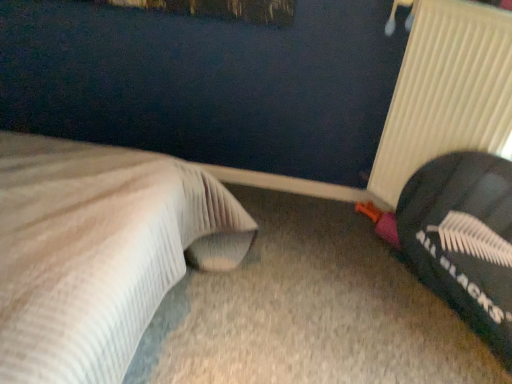
Question: Are white ribbed radiator at right and white textured bed at left making contact?

Choices:
 (A) no
 (B) yes

Answer: (A)

Question: Could white textured bed at left be considered to be inside white ribbed radiator at right?

Choices:
 (A) no
 (B) yes

Answer: (A)

Question: Is white ribbed radiator at right oriented towards white textured bed at left?

Choices:
 (A) no
 (B) yes

Answer: (B)

Question: Can you confirm if white ribbed radiator at right is shorter than white textured bed at left?

Choices:
 (A) no
 (B) yes

Answer: (B)

Question: Would you say white ribbed radiator at right is outside white textured bed at left?

Choices:
 (A) yes
 (B) no

Answer: (A)

Question: From a real-world perspective, is black fabric bean bag at right physically located above or below white ribbed radiator at right?

Choices:
 (A) above
 (B) below

Answer: (B)

Question: From their relative heights in the image, would you say black fabric bean bag at right is taller or shorter than white ribbed radiator at right?

Choices:
 (A) short
 (B) tall

Answer: (B)

Question: In terms of size, does black fabric bean bag at right appear bigger or smaller than white ribbed radiator at right?

Choices:
 (A) small
 (B) big

Answer: (B)

Question: Which is correct: black fabric bean bag at right is inside white ribbed radiator at right, or outside of it?

Choices:
 (A) inside
 (B) outside

Answer: (B)

Question: From the image's perspective, is white textured bed at left positioned above or below white ribbed radiator at right?

Choices:
 (A) above
 (B) below

Answer: (B)

Question: Is white textured bed at left taller or shorter than white ribbed radiator at right?

Choices:
 (A) tall
 (B) short

Answer: (A)

Question: From a real-world perspective, relative to white ribbed radiator at right, is white textured bed at left vertically above or below?

Choices:
 (A) above
 (B) below

Answer: (B)

Question: Is white textured bed at left situated inside white ribbed radiator at right or outside?

Choices:
 (A) outside
 (B) inside

Answer: (A)

Question: Would you say white ribbed radiator at right is to the left or to the right of white textured bed at left in the picture?

Choices:
 (A) right
 (B) left

Answer: (A)

Question: Considering the positions of white ribbed radiator at right and white textured bed at left in the image, is white ribbed radiator at right taller or shorter than white textured bed at left?

Choices:
 (A) short
 (B) tall

Answer: (A)